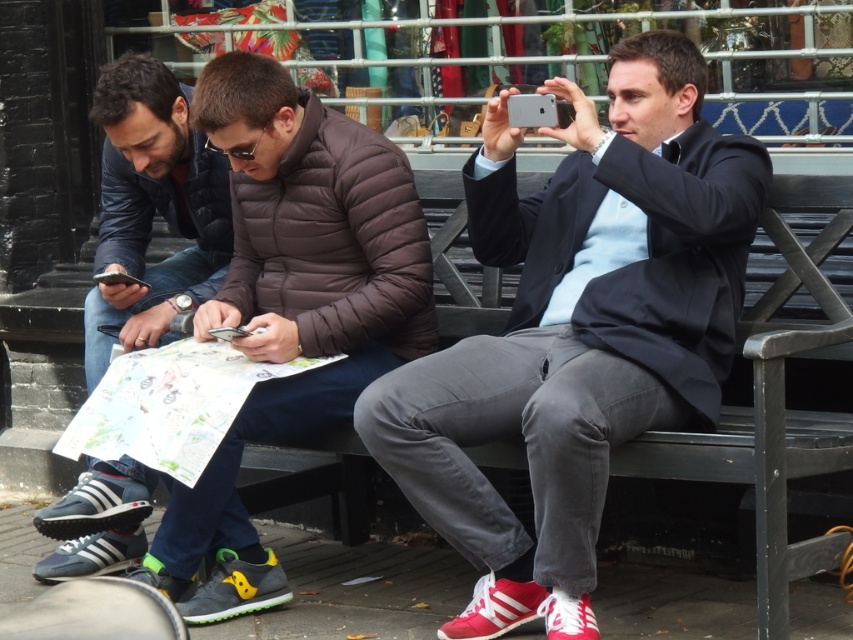
Question: Which of the following is the closest to the observer?

Choices:
 (A) (560, 561)
 (B) (236, 260)
 (C) (842, 220)

Answer: (A)

Question: Which of the following is the farthest from the observer?

Choices:
 (A) (496, 465)
 (B) (114, 554)

Answer: (B)

Question: Which point is closer to the camera?

Choices:
 (A) matte black jacket at left
 (B) matte brown jacket at center
 (C) matte black jacket at center

Answer: (C)

Question: From the image, what is the correct spatial relationship of dark gray wood bench at center in relation to matte black jacket at left?

Choices:
 (A) above
 (B) below

Answer: (B)

Question: Can you confirm if dark gray wood bench at center is thinner than matte black jacket at left?

Choices:
 (A) yes
 (B) no

Answer: (A)

Question: In this image, where is matte black jacket at center located relative to matte brown jacket at center?

Choices:
 (A) below
 (B) above

Answer: (B)